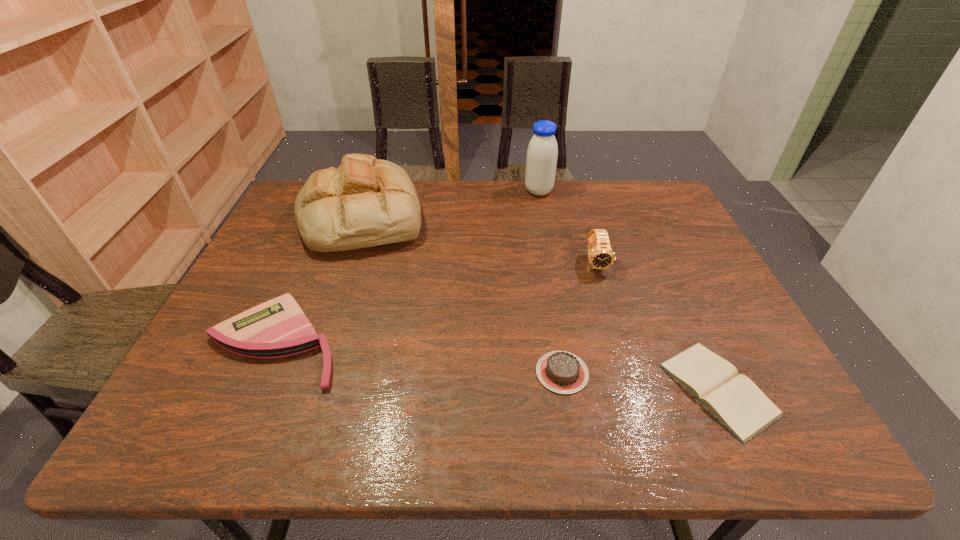
Identify the location of free space located on the face of the fourth shortest object. The image size is (960, 540). click(x=635, y=392).

At what (x,y) coordinates should I click in order to perform the action: click on vacant space located 0.200m on the back of the wristlet. Please return your answer as a coordinate pair (x, y). Image resolution: width=960 pixels, height=540 pixels. Looking at the image, I should click on (316, 251).

At what (x,y) coordinates should I click in order to perform the action: click on vacant space situated on the right of the chocolate cake. Please return your answer as a coordinate pair (x, y). This screenshot has height=540, width=960. Looking at the image, I should click on (751, 373).

Locate an element on the screen. The image size is (960, 540). free spot located 0.210m on the back of the Bible is located at coordinates 667,279.

This screenshot has width=960, height=540. I want to click on soya milk that is at the far edge, so click(542, 153).

You are a GUI agent. You are given a task and a screenshot of the screen. Output one action in this format:
    pyautogui.click(x=<x>, y=<y>)
    Task: Click on the bread that is at the far edge
    The height and width of the screenshot is (540, 960).
    Given the screenshot: What is the action you would take?
    pyautogui.click(x=365, y=202)

The width and height of the screenshot is (960, 540). In order to click on object that is at the near edge in this screenshot , I will do `click(733, 399)`.

You are a GUI agent. You are given a task and a screenshot of the screen. Output one action in this format:
    pyautogui.click(x=<x>, y=<y>)
    Task: Click on the bread that is at the left edge
    Image resolution: width=960 pixels, height=540 pixels.
    Given the screenshot: What is the action you would take?
    pyautogui.click(x=365, y=202)

Image resolution: width=960 pixels, height=540 pixels. In order to click on wristlet that is positioned at the left edge in this screenshot , I will do `click(277, 328)`.

Find the location of a particular element. Image resolution: width=960 pixels, height=540 pixels. object located in the right edge section of the desktop is located at coordinates (733, 399).